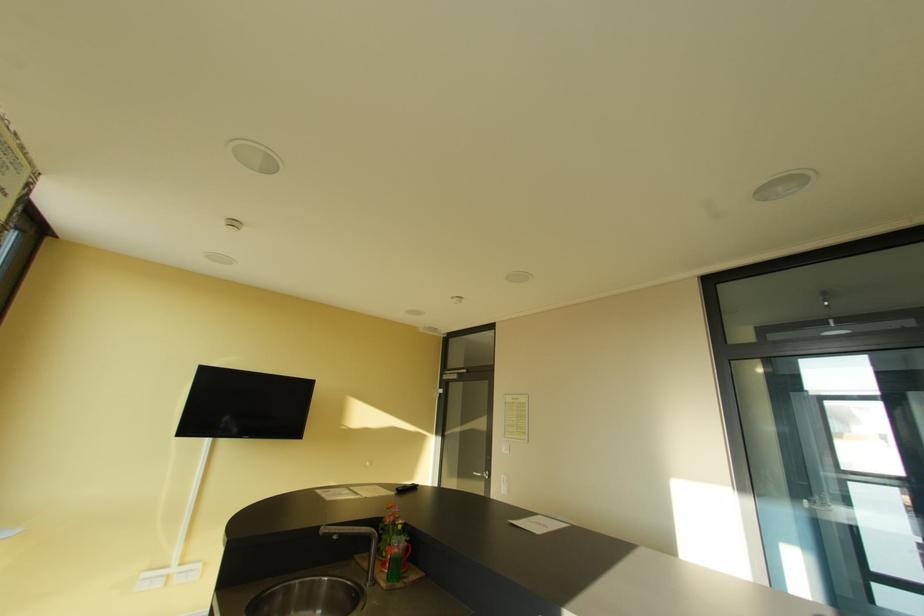
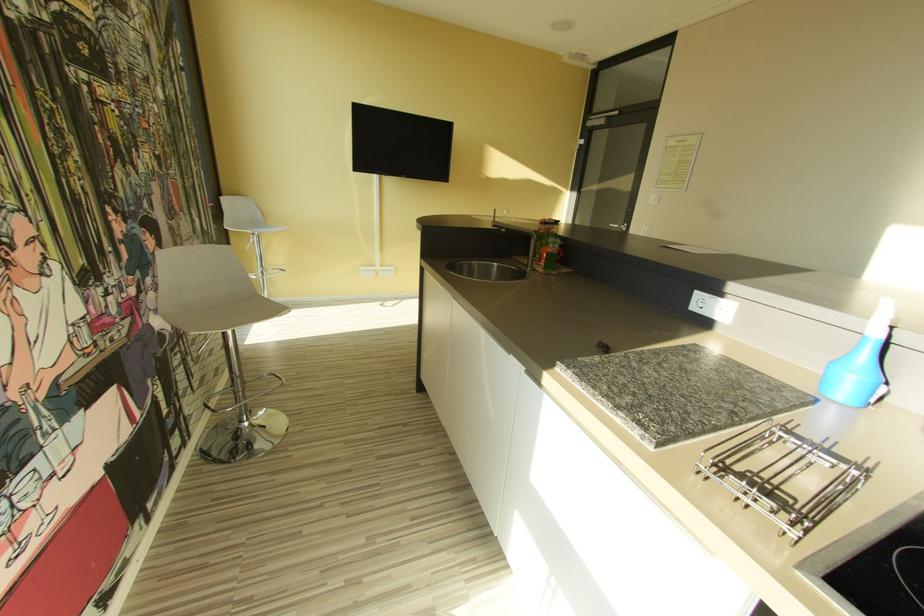
From the picture: Based on the continuous images, in which direction is the camera rotating?

The rotation direction of the camera is left-down.